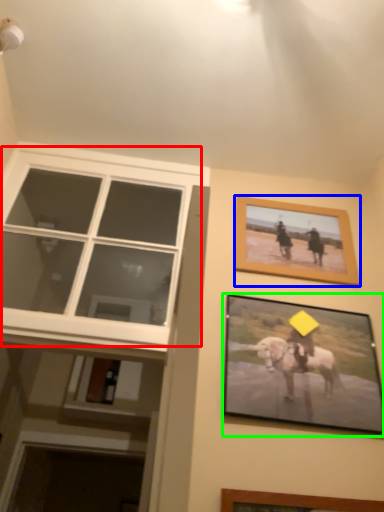
Question: Considering the real-world distances, which object is closest to window (highlighted by a red box)? picture frame (highlighted by a blue box) or picture frame (highlighted by a green box).

Choices:
 (A) picture frame
 (B) picture frame

Answer: (A)